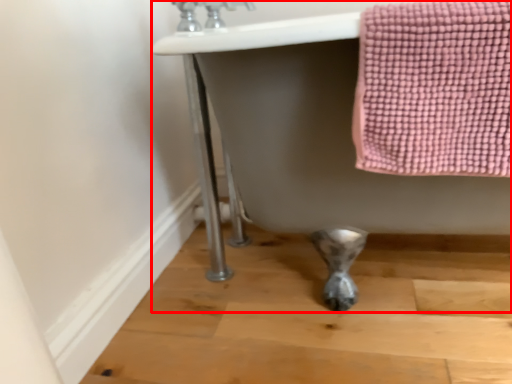
Question: From the image's perspective, what is the correct spatial relationship of bath (annotated by the red box) in relation to faucet?

Choices:
 (A) below
 (B) above

Answer: (A)